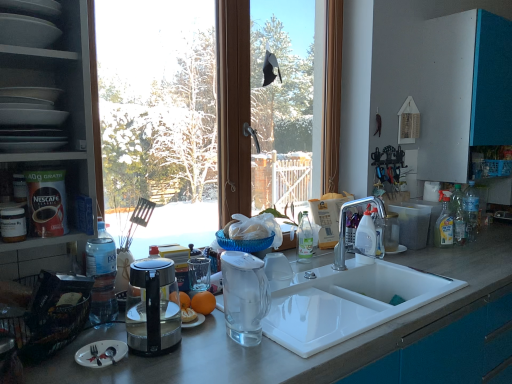
You are a GUI agent. You are given a task and a screenshot of the screen. Output one action in this format:
    pyautogui.click(x=<x>, y=<y>)
    Task: Click on the empty space that is to the right of clear plastic bottle at right, which is counted as the 2th bottle, starting from the left
    The image size is (512, 384).
    Given the screenshot: What is the action you would take?
    pyautogui.click(x=492, y=239)